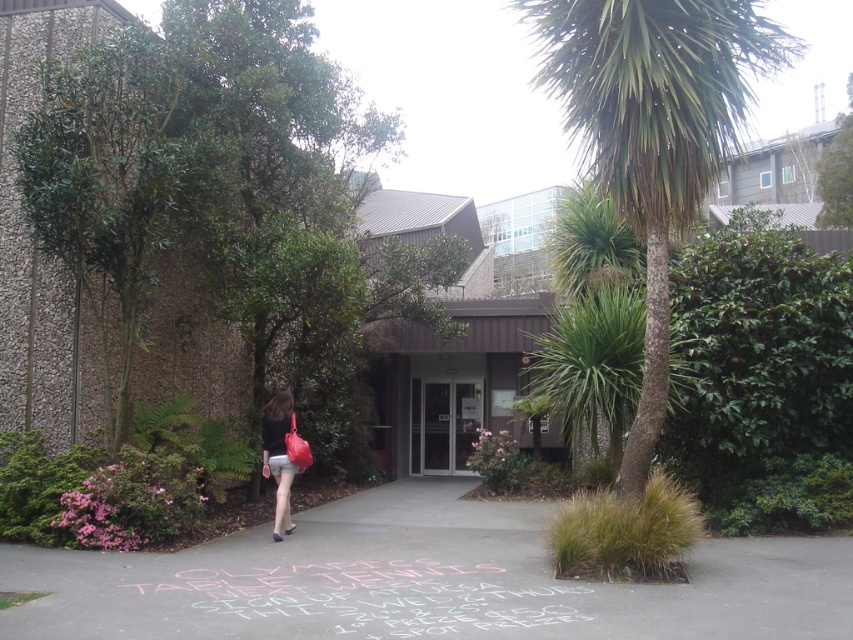
Question: Among these objects, which one is farthest from the camera?

Choices:
 (A) gray concrete pavement at center
 (B) matte pink short at center

Answer: (B)

Question: Is green leafy tree at left further to camera compared to matte pink short at center?

Choices:
 (A) no
 (B) yes

Answer: (B)

Question: Is gray concrete pavement at center positioned in front of matte black skirt at lower left?

Choices:
 (A) no
 (B) yes

Answer: (B)

Question: Which object appears farthest from the camera in this image?

Choices:
 (A) matte black skirt at lower left
 (B) gray concrete pavement at center
 (C) matte pink short at center

Answer: (C)

Question: Which object is the farthest from the matte black skirt at lower left?

Choices:
 (A) green leafy palm tree at upper right
 (B) matte pink short at center

Answer: (A)

Question: Does green leafy tree at left appear on the left side of green leafy palm tree at upper right?

Choices:
 (A) yes
 (B) no

Answer: (A)